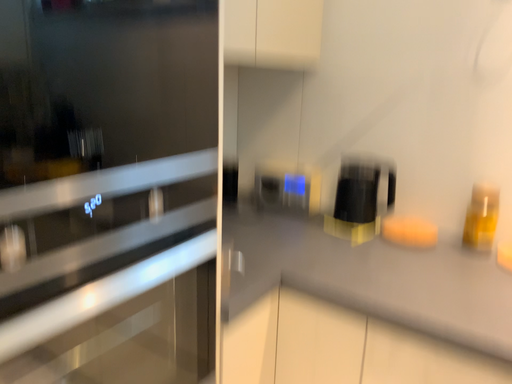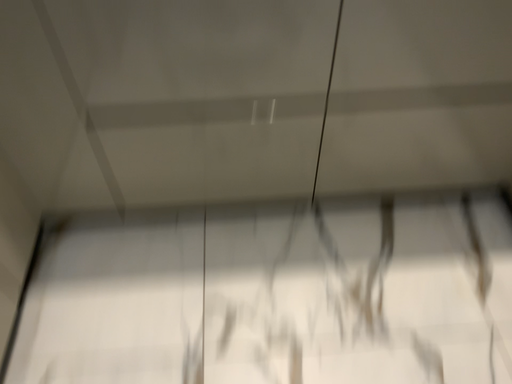
Question: How did the camera likely rotate when shooting the video?

Choices:
 (A) rotated upward
 (B) rotated downward

Answer: (B)